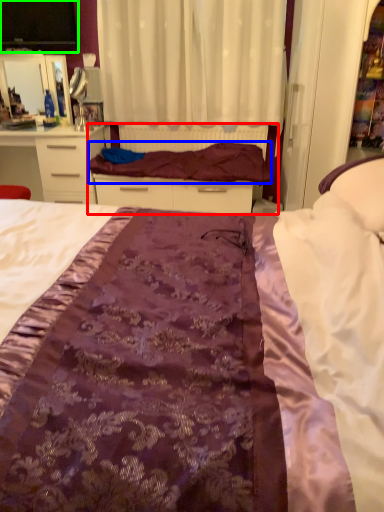
Question: Which object is the farthest from bed frame (highlighted by a red box)? Choose among these: blanket (highlighted by a blue box) or desktop (highlighted by a green box).

Choices:
 (A) blanket
 (B) desktop

Answer: (B)